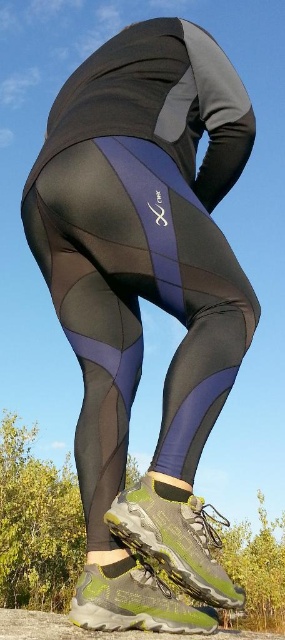
Question: Is green mesh shoe at lower center thinner than green textured hiking boot at lower center?

Choices:
 (A) yes
 (B) no

Answer: (A)

Question: Is the position of green mesh shoe at lower center less distant than that of green textured hiking boot at lower center?

Choices:
 (A) no
 (B) yes

Answer: (B)

Question: Which object appears farthest from the camera in this image?

Choices:
 (A) green textured hiking boot at lower center
 (B) green mesh shoe at lower center

Answer: (A)

Question: Is green mesh shoe at lower center positioned at the back of green textured hiking boot at lower center?

Choices:
 (A) no
 (B) yes

Answer: (A)

Question: Which object appears farthest from the camera in this image?

Choices:
 (A) green textured hiking boot at lower center
 (B) green mesh shoe at lower center

Answer: (A)

Question: Which point appears farthest from the camera in this image?

Choices:
 (A) (163, 497)
 (B) (100, 573)

Answer: (B)